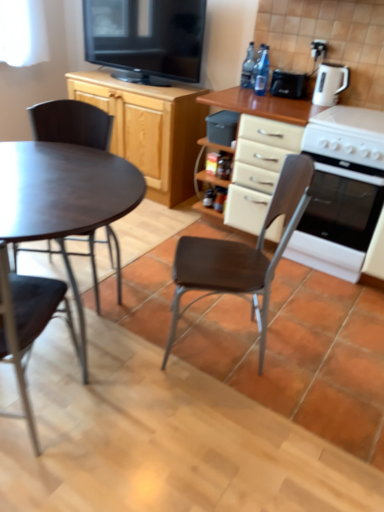
Image resolution: width=384 pixels, height=512 pixels. In order to click on vacant space to the right of matte dark brown table at left in this screenshot , I will do `click(225, 389)`.